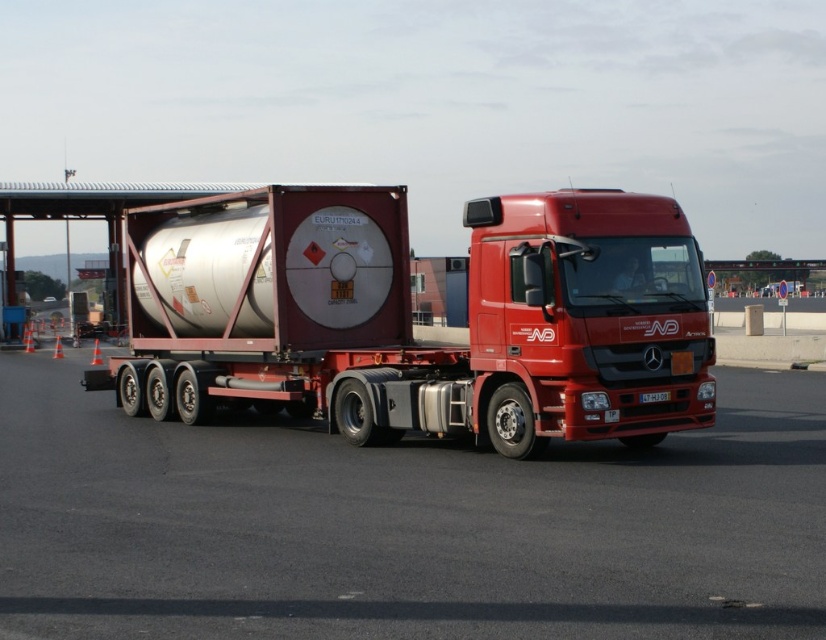
Looking at this image, you are a delivery driver who needs to unload the metallic silver tank at center from the truck. The loading bay where you need to park has a maximum width of 2 meters. Can you safely unload the tank if the metallic asphalt at center is narrower than the tank?

The metallic asphalt at center has a smaller size compared to the metallic silver tank at center. Since the asphalt is narrower than the tank, the tank may not fit within the 2 meter loading bay width, so it might not be safe to unload the tank there.

What is the purpose of the point marked at coordinates (404,525) on the image?

The point marked at coordinates (404,525) indicates the location of the metallic asphalt at center.

You are a delivery driver who needs to maneuver your truck through a narrow alleyway. The alleyway is only wide enough to accommodate objects up to the width of the metallic silver tank at center. Can your truck, including the metallic asphalt at center, safely pass through the alleyway without hitting the sides?

The metallic asphalt at center is wider than the metallic silver tank at center. Since the alleyway can only accommodate the width of the metallic silver tank at center, the truck including the metallic asphalt at center would be too wide and cannot safely pass through the alleyway without hitting the sides.